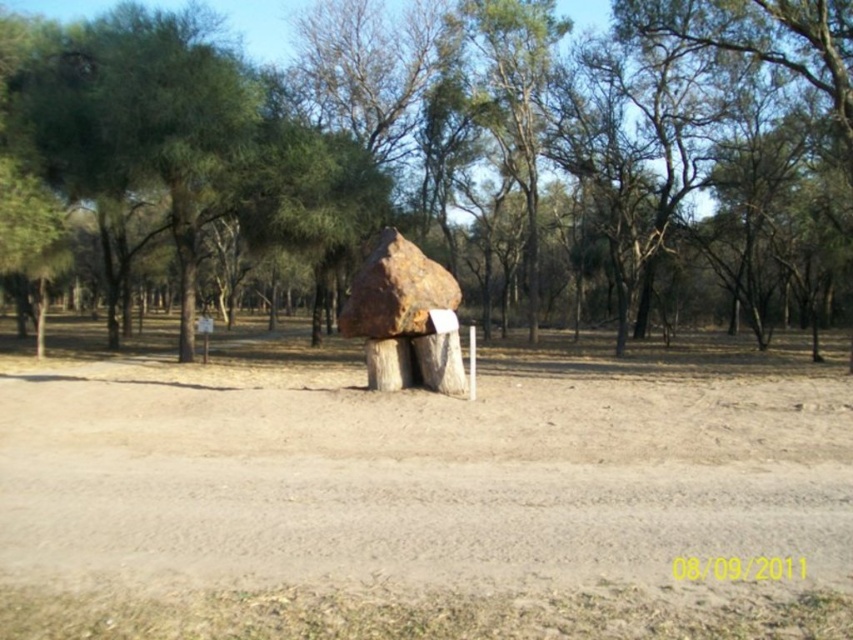
Question: Does brown dirt field at center lie behind rustic wood sculpture at center?

Choices:
 (A) no
 (B) yes

Answer: (A)

Question: Can you confirm if brown dirt field at center is smaller than rustic wood sculpture at center?

Choices:
 (A) yes
 (B) no

Answer: (A)

Question: Estimate the real-world distances between objects in this image. Which object is closer to the green leafy tree at upper center?

Choices:
 (A) rustic wood sculpture at center
 (B) brown dirt field at center

Answer: (B)

Question: Is brown dirt field at center above rustic wood sculpture at center?

Choices:
 (A) no
 (B) yes

Answer: (A)

Question: Which point is farther to the camera?

Choices:
 (A) rustic wood sculpture at center
 (B) brown dirt field at center
 (C) green leafy tree at upper center

Answer: (C)

Question: Among these objects, which one is nearest to the camera?

Choices:
 (A) brown dirt field at center
 (B) green leafy tree at upper center
 (C) rustic wood sculpture at center

Answer: (A)